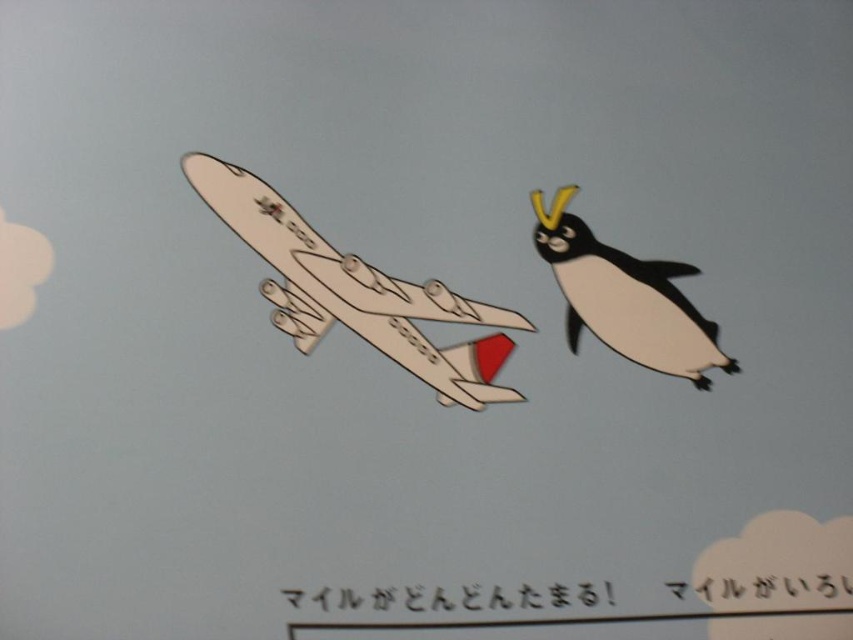
Describe the element at coordinates (355, 291) in the screenshot. The height and width of the screenshot is (640, 853). I see `white cardboard airplane at center` at that location.

Is white cardboard airplane at center further to camera compared to white paper penguin at right?

No, white cardboard airplane at center is in front of white paper penguin at right.

Is point (480, 310) more distant than point (703, 378)?

That is False.

Locate an element on the screen. This screenshot has height=640, width=853. white cardboard airplane at center is located at coordinates (355, 291).